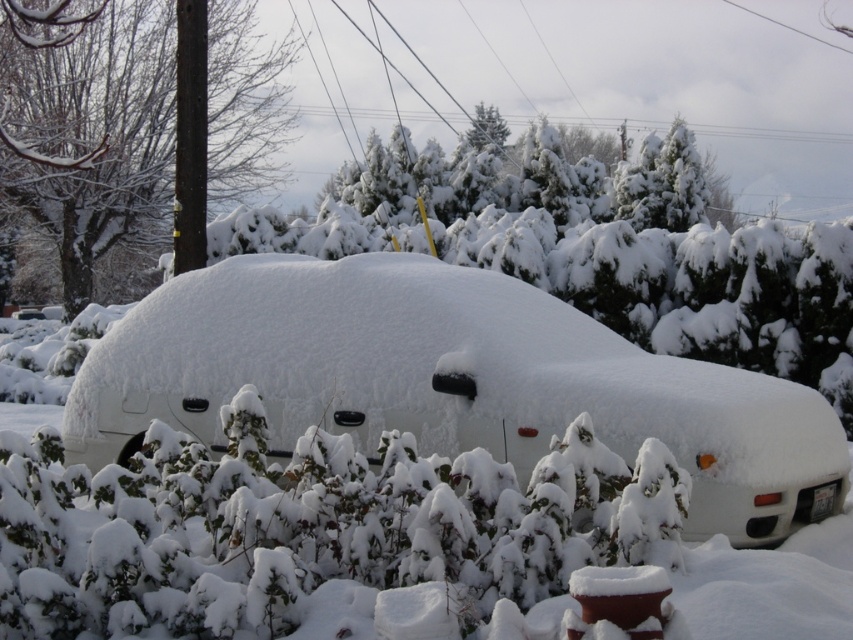
You are standing in the snowy scene and see the point marked at coordinates [310,529]. What object is located at this point?

The point at [310,529] marks a white fluffy bush at lower center.

You are standing in the snowy winter scene described. There is a point at coordinates (450, 380). What object is located at this point?

The point at (450, 380) corresponds to the white matte car at center.